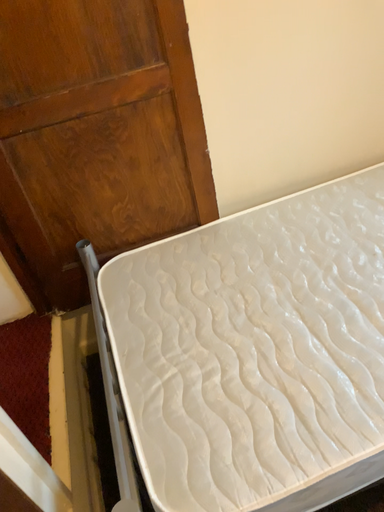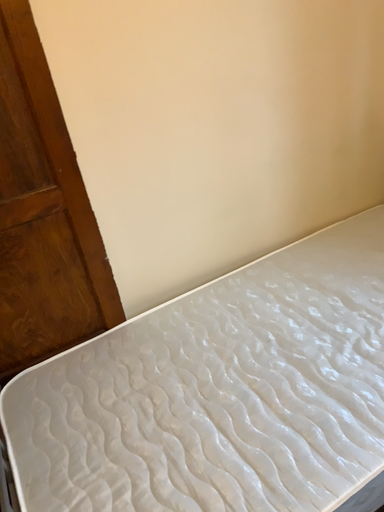
Question: Which way did the camera rotate in the video?

Choices:
 (A) rotated upward
 (B) rotated downward

Answer: (A)